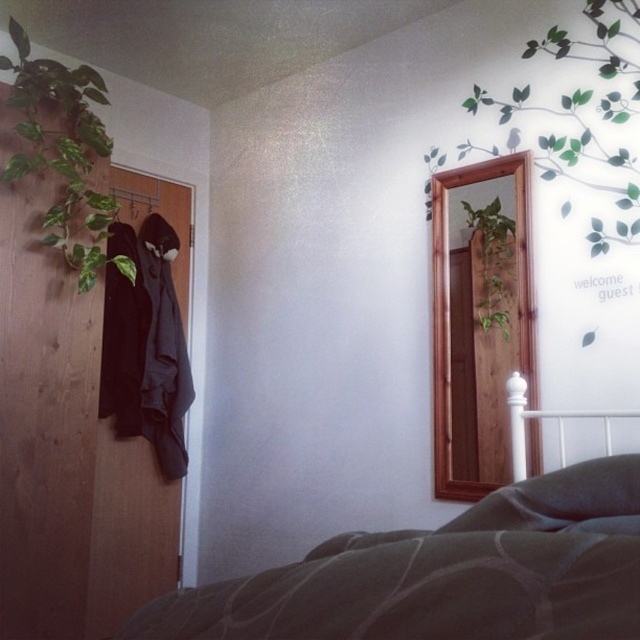
Question: Is dark green textured bedspread at lower center thinner than green matte plant at upper left?

Choices:
 (A) no
 (B) yes

Answer: (A)

Question: Which of the following is the closest to the observer?

Choices:
 (A) green matte plant at upper left
 (B) green matte plant at upper right

Answer: (B)

Question: Which object is farther from the camera taking this photo?

Choices:
 (A) green matte plant at upper left
 (B) dark green textured bedspread at lower center

Answer: (A)

Question: Observing the image, what is the correct spatial positioning of green matte plant at upper right in reference to green matte plant at center?

Choices:
 (A) left
 (B) right

Answer: (B)

Question: Which of the following is the farthest from the observer?

Choices:
 (A) (13, 104)
 (B) (506, 241)
 (C) (554, 556)

Answer: (B)

Question: Is green matte plant at upper left bigger than green matte plant at center?

Choices:
 (A) yes
 (B) no

Answer: (A)